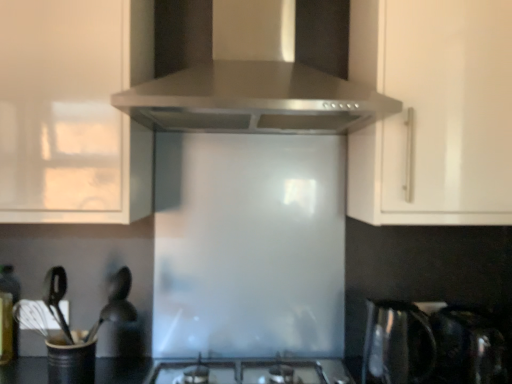
Question: Is black matte utensil holder at lower left, which is the 1th appliance in left-to-right order, taller than satin black kettle at lower right, arranged as the first appliance when viewed from the right?

Choices:
 (A) yes
 (B) no

Answer: (B)

Question: From the image's perspective, is black matte utensil holder at lower left, the 2th appliance viewed from the right, on satin black kettle at lower right, the second appliance positioned from the left?

Choices:
 (A) no
 (B) yes

Answer: (A)

Question: Can you confirm if black matte utensil holder at lower left, the 2th appliance viewed from the right, is bigger than satin black kettle at lower right, the second appliance positioned from the left?

Choices:
 (A) yes
 (B) no

Answer: (B)

Question: Is black matte utensil holder at lower left, the 2th appliance viewed from the right, turned away from satin black kettle at lower right, the second appliance positioned from the left?

Choices:
 (A) yes
 (B) no

Answer: (B)

Question: Can we say black matte utensil holder at lower left, the 2th appliance viewed from the right, lies outside satin black kettle at lower right, the second appliance positioned from the left?

Choices:
 (A) yes
 (B) no

Answer: (A)

Question: Would you consider black matte utensil holder at lower left, the 2th appliance viewed from the right, to be distant from satin black kettle at lower right, arranged as the first appliance when viewed from the right?

Choices:
 (A) no
 (B) yes

Answer: (B)

Question: Considering the relative positions of black matte utensil holder at lower left, the 2th appliance viewed from the right, and white glossy cabinet at upper left, which is the second cabinetry in right-to-left order, in the image provided, is black matte utensil holder at lower left, the 2th appliance viewed from the right, to the right of white glossy cabinet at upper left, which is the second cabinetry in right-to-left order, from the viewer's perspective?

Choices:
 (A) yes
 (B) no

Answer: (A)

Question: From the image's perspective, is black matte utensil holder at lower left, which is the 1th appliance in left-to-right order, beneath white glossy cabinet at upper left, which is the second cabinetry in right-to-left order?

Choices:
 (A) no
 (B) yes

Answer: (B)

Question: Is black matte utensil holder at lower left, the 2th appliance viewed from the right, completely or partially outside of white glossy cabinet at upper left, which appears as the first cabinetry when viewed from the left?

Choices:
 (A) no
 (B) yes

Answer: (B)

Question: Considering the relative sizes of black matte utensil holder at lower left, the 2th appliance viewed from the right, and white glossy cabinet at upper left, which appears as the first cabinetry when viewed from the left, in the image provided, is black matte utensil holder at lower left, the 2th appliance viewed from the right, bigger than white glossy cabinet at upper left, which appears as the first cabinetry when viewed from the left,?

Choices:
 (A) yes
 (B) no

Answer: (B)

Question: Does black matte utensil holder at lower left, which is the 1th appliance in left-to-right order, lie behind white glossy cabinet at upper left, which appears as the first cabinetry when viewed from the left?

Choices:
 (A) no
 (B) yes

Answer: (B)

Question: Could you tell me if black matte utensil holder at lower left, the 2th appliance viewed from the right, is turned towards white glossy cabinet at upper left, which appears as the first cabinetry when viewed from the left?

Choices:
 (A) no
 (B) yes

Answer: (A)

Question: Is satin metallic kettle at lower right oriented away from satin silver gas stove at center?

Choices:
 (A) no
 (B) yes

Answer: (A)